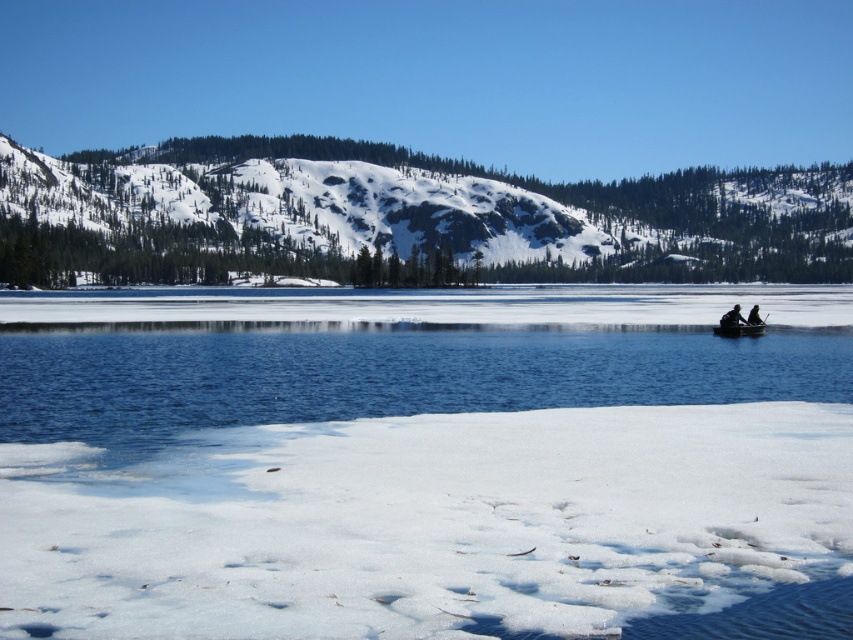
Does snowy forested hill at upper left have a greater width compared to wooden canoe at center?

Indeed, snowy forested hill at upper left has a greater width compared to wooden canoe at center.

From the picture: Can you confirm if snowy forested hill at upper left is positioned to the left of wooden canoe at center?

Incorrect, snowy forested hill at upper left is not on the left side of wooden canoe at center.

Describe the element at coordinates (402, 218) in the screenshot. I see `snowy forested hill at upper left` at that location.

Find the location of `snowy forested hill at upper left`. snowy forested hill at upper left is located at coordinates (402, 218).

Is wooden canoe at center shorter than black plastic boat at right?

Yes, wooden canoe at center is shorter than black plastic boat at right.

Can you confirm if wooden canoe at center is positioned above black plastic boat at right?

No.

Where is `wooden canoe at center`? This screenshot has height=640, width=853. wooden canoe at center is located at coordinates (738, 328).

Describe the element at coordinates (427, 522) in the screenshot. This screenshot has height=640, width=853. I see `white fluffy snow at lower center` at that location.

Between white fluffy snow at lower center and snowy forested hill at upper left, which one has less height?

white fluffy snow at lower center is shorter.

The image size is (853, 640). Find the location of `white fluffy snow at lower center`. white fluffy snow at lower center is located at coordinates (427, 522).